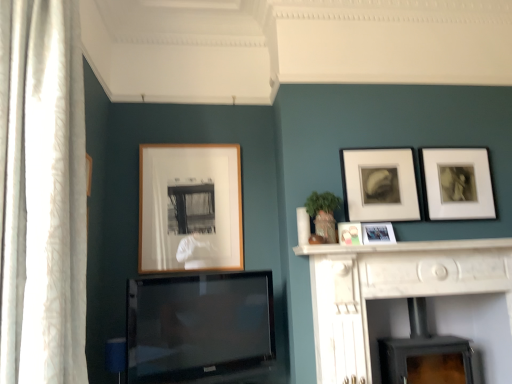
In order to click on vacant space in front of matte plastic picture frame at upper center, the 4th picture frame viewed from the right in this screenshot , I will do `click(348, 248)`.